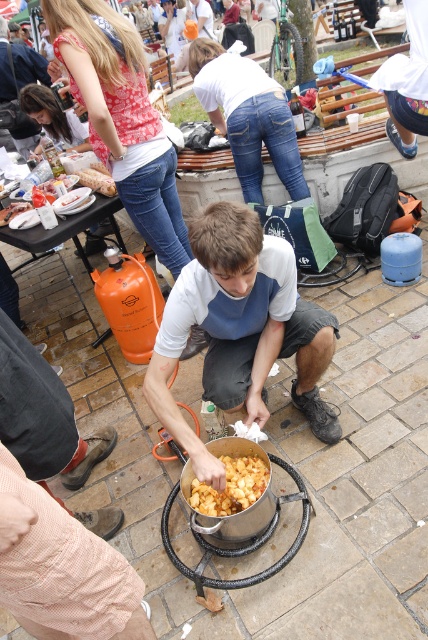
Question: Which object is farther from the camera taking this photo?

Choices:
 (A) matte white shirt at center
 (B) golden crispy chips at center

Answer: (B)

Question: Can you confirm if matte white shirt at center is thinner than golden crispy chips at center?

Choices:
 (A) yes
 (B) no

Answer: (B)

Question: In this image, where is matte white shirt at center located relative to golden crispy chips at center?

Choices:
 (A) above
 (B) below

Answer: (A)

Question: Considering the relative positions of matte white shirt at center and golden crispy chips at center in the image provided, where is matte white shirt at center located with respect to golden crispy chips at center?

Choices:
 (A) above
 (B) below

Answer: (A)